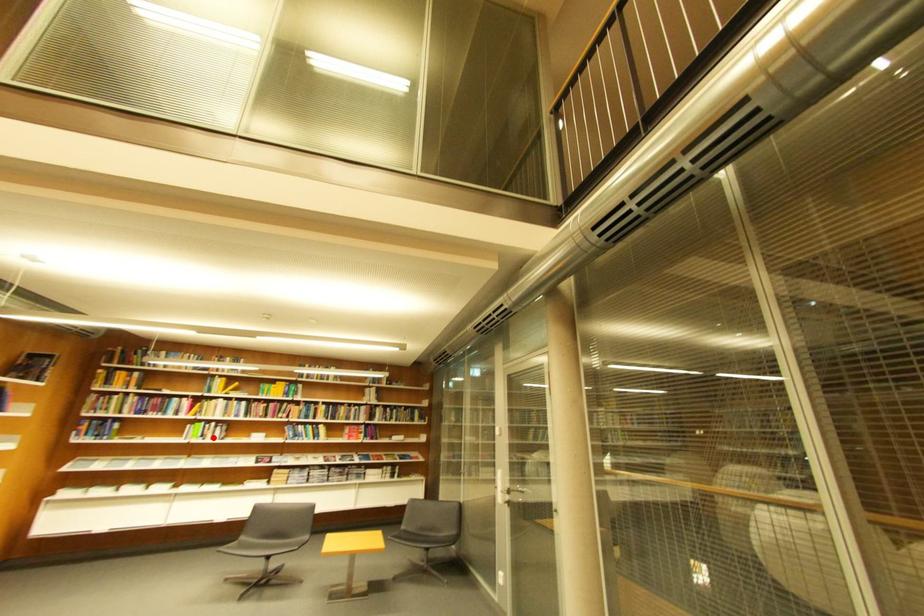
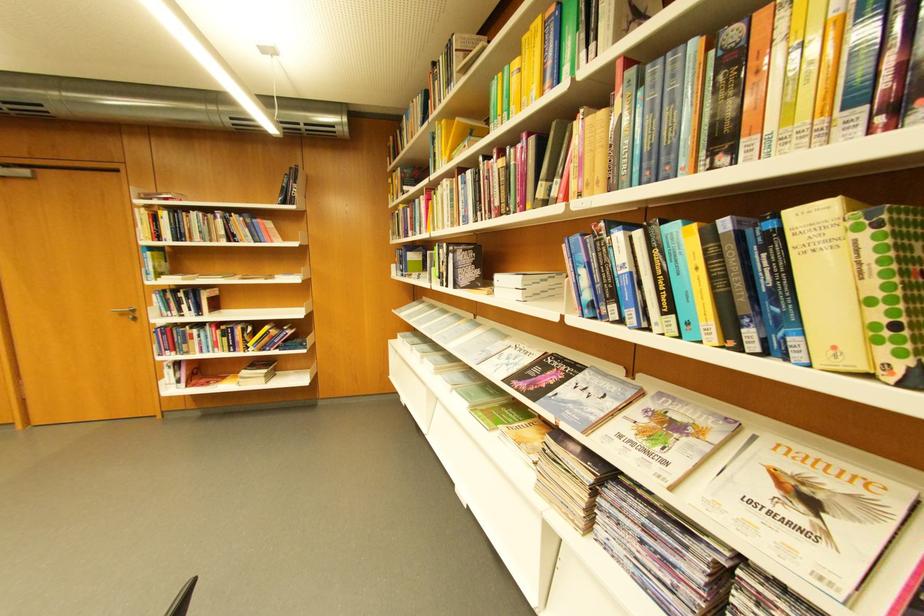
Find the pixel in the second image that matches the highlighted location in the first image.

(451, 278)